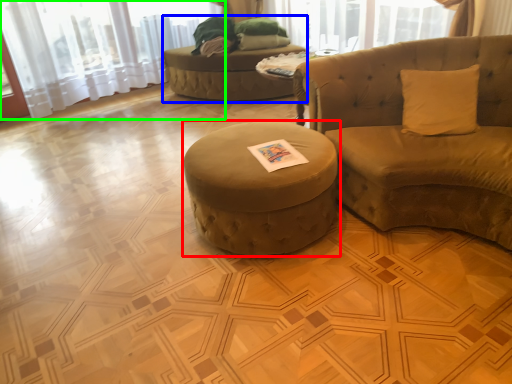
Question: Based on their relative distances, which object is nearer to table (highlighted by a red box)? Choose from bean bag chair (highlighted by a blue box) and curtain (highlighted by a green box).

Choices:
 (A) bean bag chair
 (B) curtain

Answer: (A)